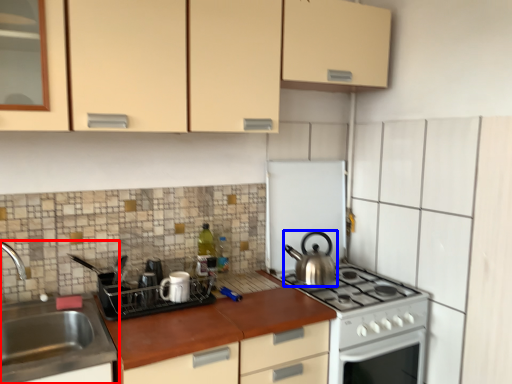
Question: Which point is further to the camera, sink (highlighted by a red box) or kitchen appliance (highlighted by a blue box)?

Choices:
 (A) sink
 (B) kitchen appliance

Answer: (B)